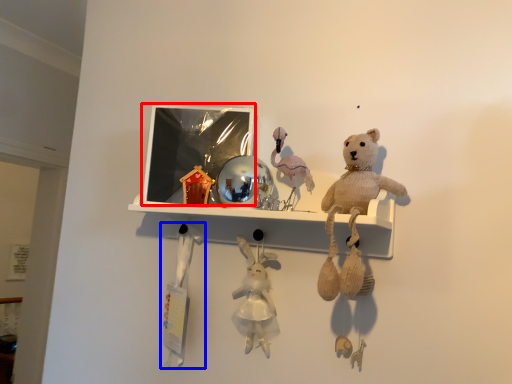
Question: Which object is further to the camera taking this photo, picture frame (highlighted by a red box) or toy (highlighted by a blue box)?

Choices:
 (A) picture frame
 (B) toy

Answer: (B)